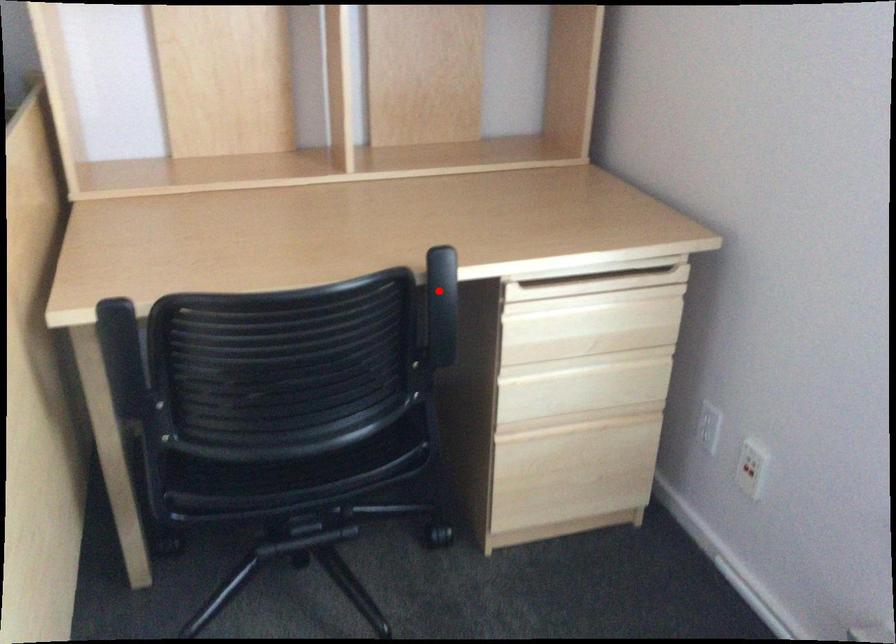
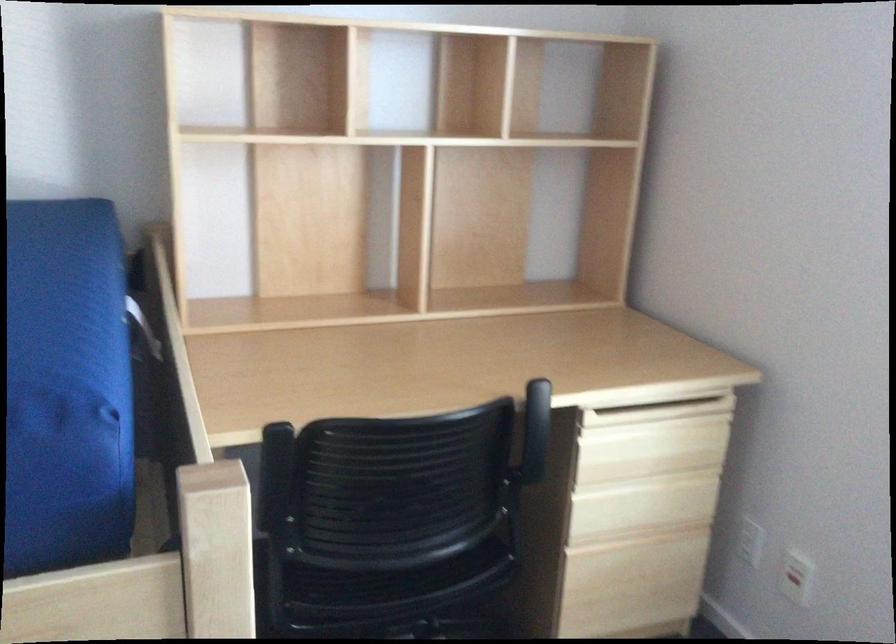
Question: I am providing you with two images of the same scene from different viewpoints. A red point is shown in image1. For the corresponding object point in image2, is it positioned nearer or farther from the camera?

Choices:
 (A) Nearer
 (B) Farther

Answer: (B)